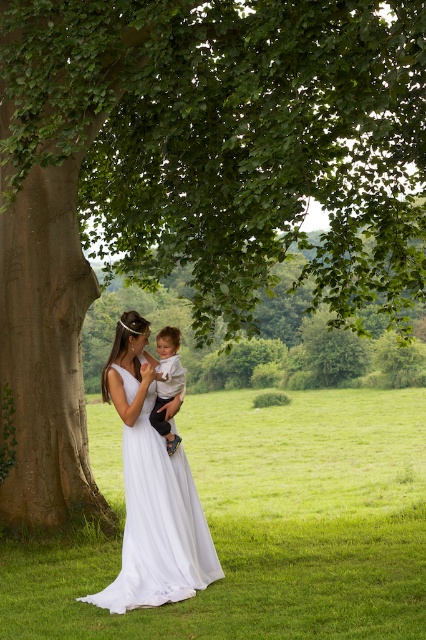
Question: Which point is closer to the camera taking this photo?

Choices:
 (A) (189, 544)
 (B) (172, 374)

Answer: (A)

Question: In this image, where is white chiffon dress at center located relative to white cotton shirt at center?

Choices:
 (A) right
 (B) left

Answer: (B)

Question: Does white chiffon dress at center have a lesser width compared to white cotton shirt at center?

Choices:
 (A) no
 (B) yes

Answer: (A)

Question: Can you confirm if white chiffon dress at center is positioned above white cotton shirt at center?

Choices:
 (A) no
 (B) yes

Answer: (A)